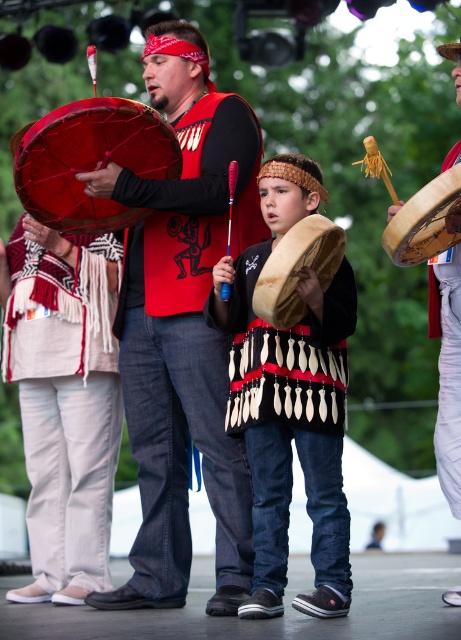
In the scene shown: You are a photographer trying to capture the cultural performance. You need to place a camera on the ground near the white woven fabric at lower left. Based on its position, where should you place the camera relative to the main performers?

The white woven fabric at lower left is located at point [64,401], so you should place the camera near that coordinate to capture the main performers effectively.